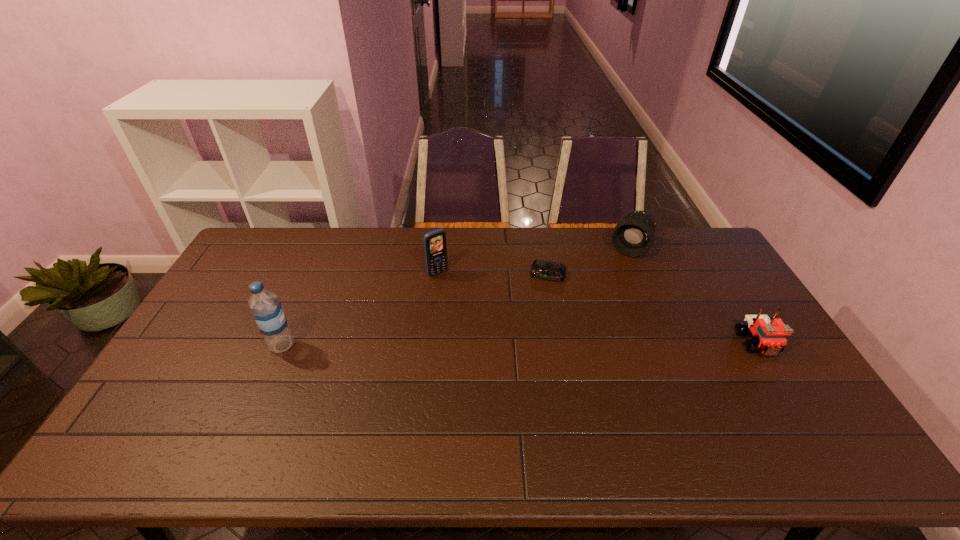
In order to click on the tallest object in this screenshot , I will do `click(267, 310)`.

Find the location of a particular element. This screenshot has height=540, width=960. water bottle is located at coordinates (267, 310).

The height and width of the screenshot is (540, 960). In order to click on the fourth tallest object in this screenshot , I will do tap(768, 334).

This screenshot has width=960, height=540. I want to click on the rightmost object, so click(768, 334).

Where is `the shortest object`? The height and width of the screenshot is (540, 960). the shortest object is located at coordinates (541, 269).

This screenshot has height=540, width=960. I want to click on alarm clock, so click(541, 269).

This screenshot has height=540, width=960. What are the coordinates of `cellular telephone` in the screenshot? It's located at (435, 247).

I want to click on the fourth shortest object, so click(x=435, y=247).

Image resolution: width=960 pixels, height=540 pixels. Identify the location of telephoto lens. click(x=633, y=236).

Where is `the farthest object`? This screenshot has height=540, width=960. the farthest object is located at coordinates (633, 236).